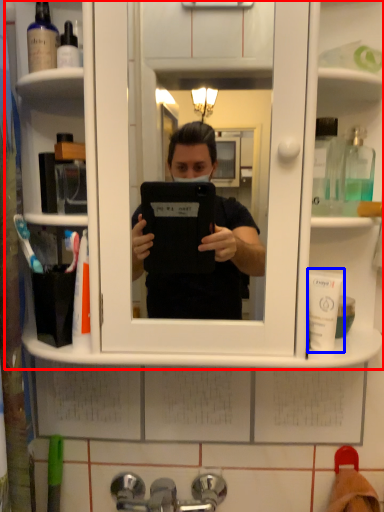
Question: Which object appears closest to the camera in this image, cabinet (highlighted by a red box) or mouthwash (highlighted by a blue box)?

Choices:
 (A) cabinet
 (B) mouthwash

Answer: (A)